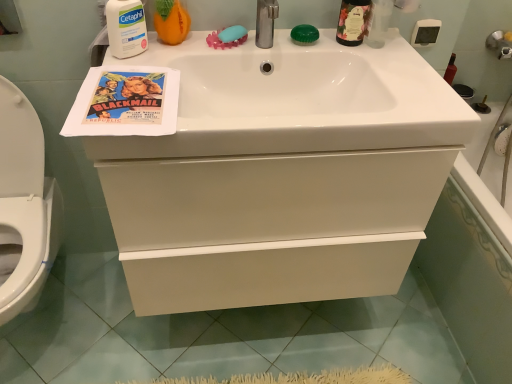
Where is `free space above matte paper poster at upper left (from a real-world perspective)`? The height and width of the screenshot is (384, 512). free space above matte paper poster at upper left (from a real-world perspective) is located at coordinates (121, 99).